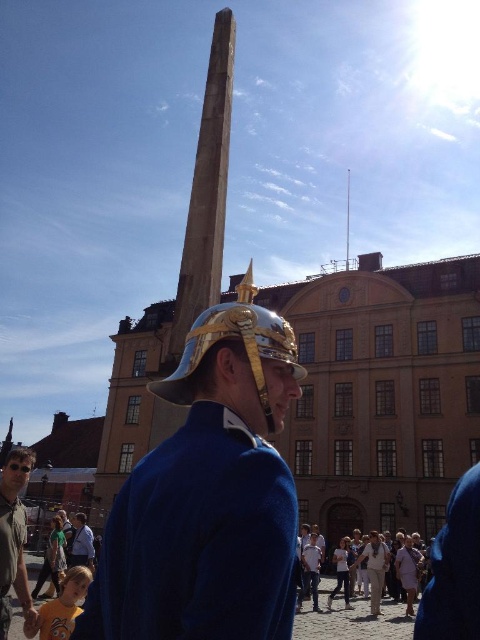
Can you confirm if gold plated helmet at center is shorter than matte gray shirt at lower left?

Yes.

Can you confirm if gold plated helmet at center is wider than matte gray shirt at lower left?

Incorrect, gold plated helmet at center's width does not surpass matte gray shirt at lower left's.

Based on the photo, who is more distant from viewer, (243, 340) or (14, 577)?

The point (14, 577) is more distant.

The width and height of the screenshot is (480, 640). What are the coordinates of `gold plated helmet at center` in the screenshot? It's located at (242, 348).

Who is lower down, metallic helmet at center or matte gray shirt at lower left?

Positioned lower is matte gray shirt at lower left.

Does point (153, 566) come in front of point (23, 461)?

Yes.

This screenshot has height=640, width=480. Identify the location of metallic helmet at center. (207, 497).

Is metallic helmet at center to the right of gold plated helmet at center from the viewer's perspective?

In fact, metallic helmet at center is to the left of gold plated helmet at center.

The height and width of the screenshot is (640, 480). What do you see at coordinates (207, 497) in the screenshot?
I see `metallic helmet at center` at bounding box center [207, 497].

Which is in front, point (201, 465) or point (267, 413)?

Point (201, 465) is in front.

Locate an element on the screen. metallic helmet at center is located at coordinates (207, 497).